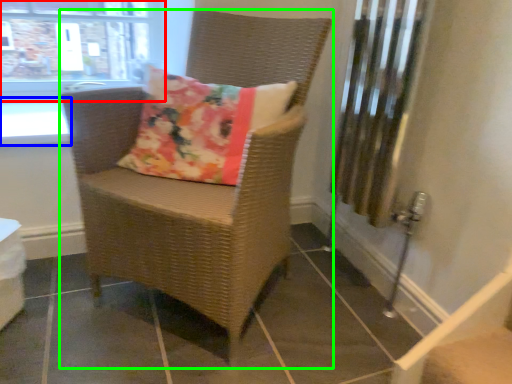
Question: Considering the real-world distances, which object is closest to window (highlighted by a red box)? window sill (highlighted by a blue box) or chair (highlighted by a green box).

Choices:
 (A) window sill
 (B) chair

Answer: (A)